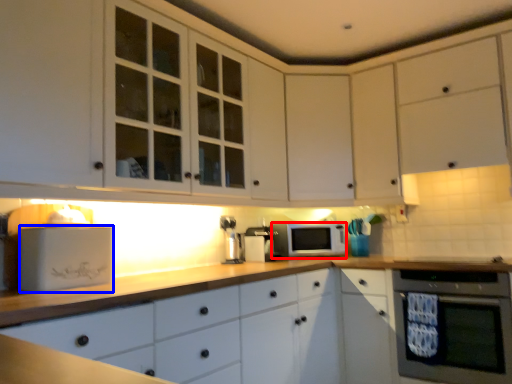
Question: Which of the following is the closest to the observer, microwave oven (highlighted by a red box) or appliance (highlighted by a blue box)?

Choices:
 (A) microwave oven
 (B) appliance

Answer: (B)